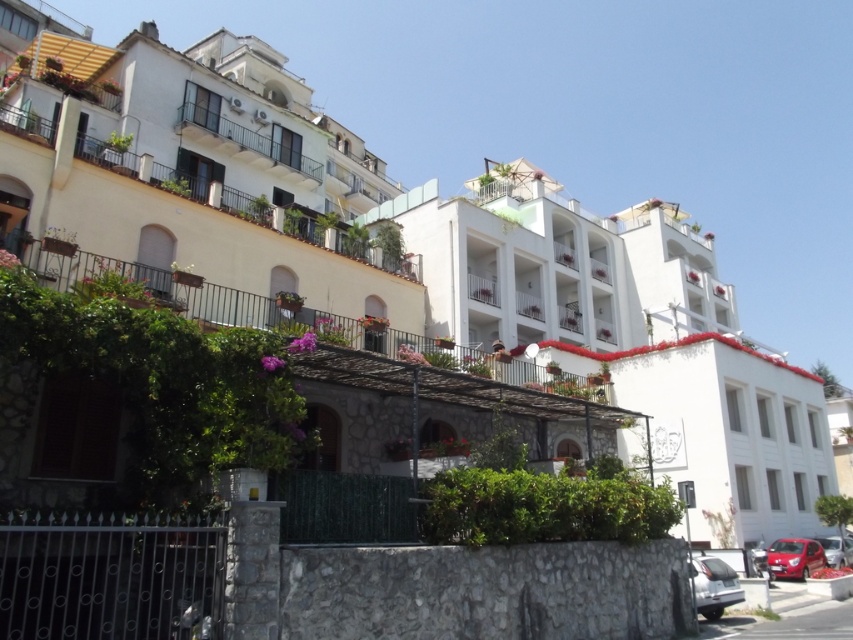
You are a delivery person trying to park a truck that is 2 meters wide. You see the silver metallic car at lower right and the metallic red car at lower right parked in the area. Can you determine if there is enough space between them to park your truck?

The silver metallic car at lower right might be wider than metallic red car at lower right, so the space between them may not be sufficient for a 2 meter wide truck. Please check the actual width before attempting to park.

You are standing on the sidewalk in front of the residential area. You want to take a photo of the white stone building at center. If your camera can focus on objects up to 30 meters away, will you need to move closer to get a clear shot?

The white stone building at center is 31.91 meters from viewer. Since it is slightly beyond the camera focus range of 30 meters, you need to move closer to ensure the building is within the focus range.